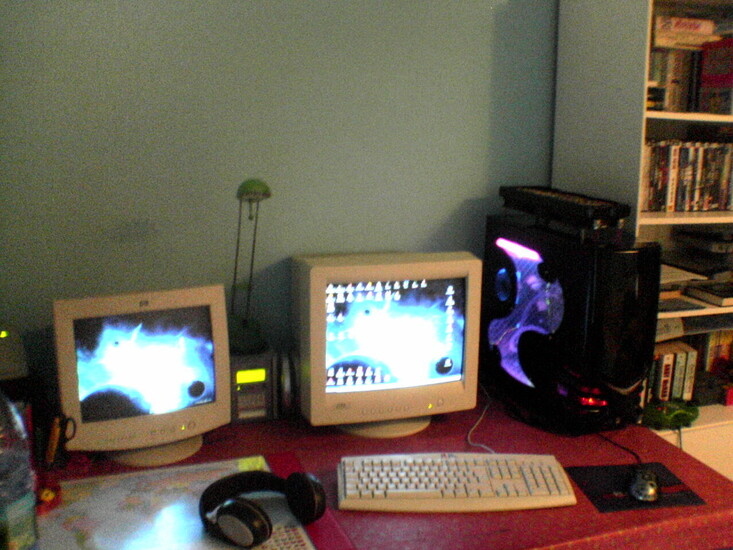
At what (x,y) coordinates should I click in order to perform the action: click on computer keyboard. Please return your answer as a coordinate pair (x, y). The height and width of the screenshot is (550, 733). Looking at the image, I should click on (438, 483).